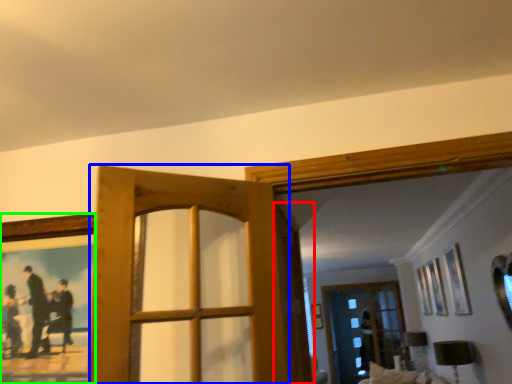
Question: Considering the real-world distances, which object is farthest from screen door (highlighted by a red box)? door (highlighted by a blue box) or picture frame (highlighted by a green box)?

Choices:
 (A) door
 (B) picture frame

Answer: (B)